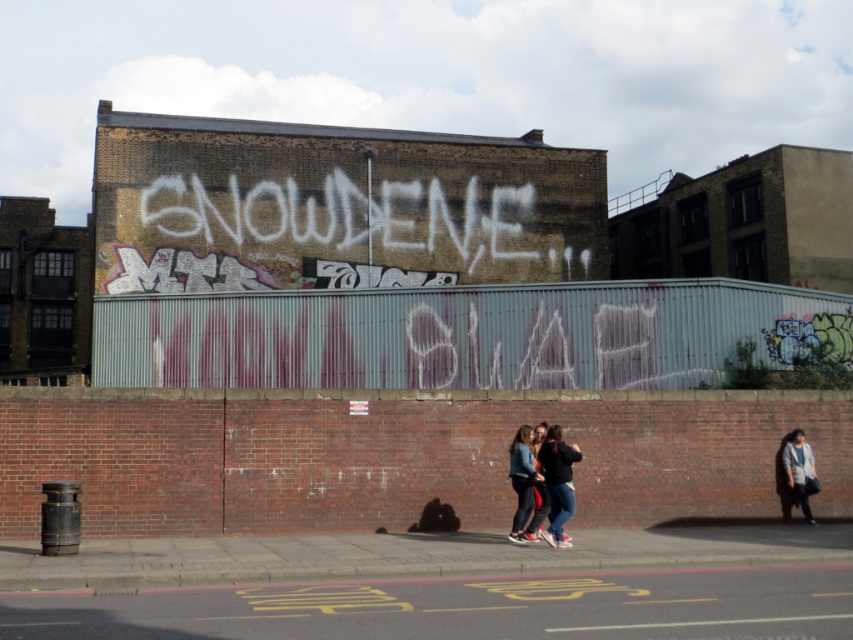
Question: Where is white chalk graffiti at center located in relation to jeans at center in the image?

Choices:
 (A) above
 (B) below

Answer: (A)

Question: Which point is closer to the camera?

Choices:
 (A) (570, 483)
 (B) (531, 476)
 (C) (305, 209)
 (D) (813, 465)

Answer: (A)

Question: Is jeans at center smaller than dark gray jacket at right?

Choices:
 (A) yes
 (B) no

Answer: (B)

Question: Is denim jacket at center positioned in front of dark gray jacket at right?

Choices:
 (A) no
 (B) yes

Answer: (B)

Question: Which of these objects is positioned farthest from the jeans at center?

Choices:
 (A) dark gray jacket at right
 (B) denim jacket at center
 (C) white chalk graffiti at center

Answer: (C)

Question: Among these objects, which one is farthest from the camera?

Choices:
 (A) jeans at center
 (B) denim jacket at center
 (C) white chalk graffiti at center
 (D) dark gray jacket at right

Answer: (C)